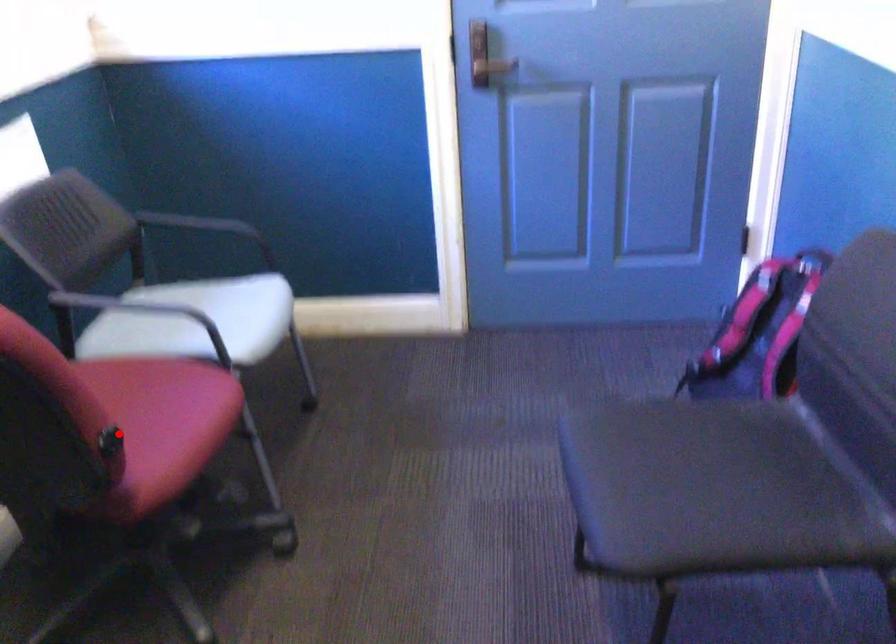
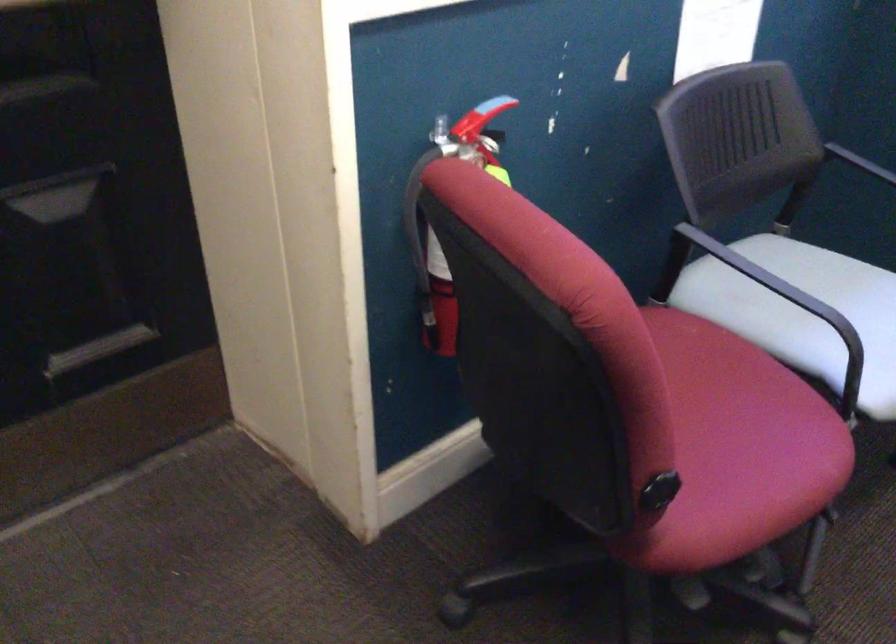
Locate, in the second image, the point that corresponds to the highlighted location in the first image.

(658, 494)